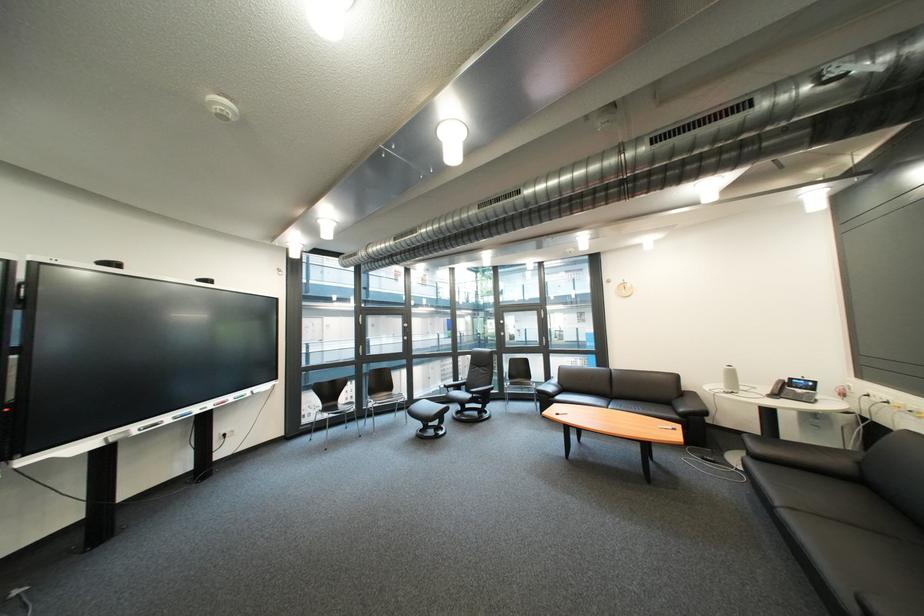
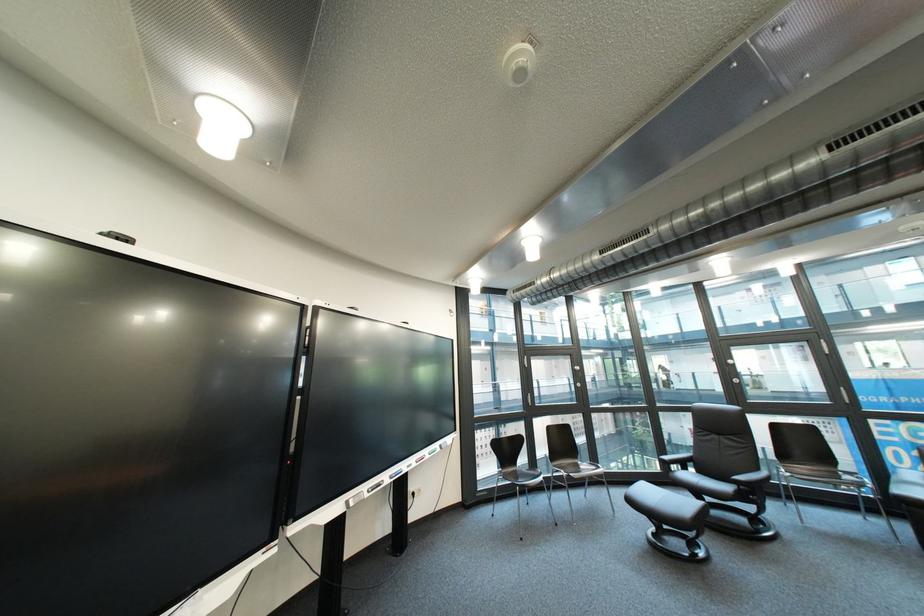
The images are taken continuously from a first-person perspective. In which direction are you moving?

The cameraman walked toward left, forward.